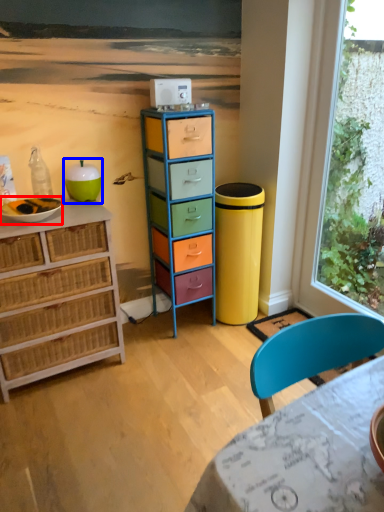
Question: Which object is closer to the camera taking this photo, bowl (highlighted by a red box) or teal (highlighted by a blue box)?

Choices:
 (A) bowl
 (B) teal

Answer: (A)